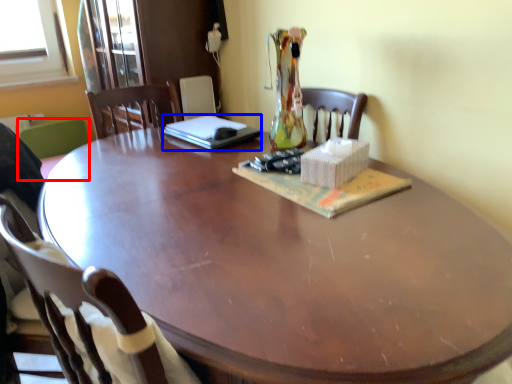
Question: Which point is further to the camera, chair (highlighted by a red box) or laptop (highlighted by a blue box)?

Choices:
 (A) chair
 (B) laptop

Answer: (A)